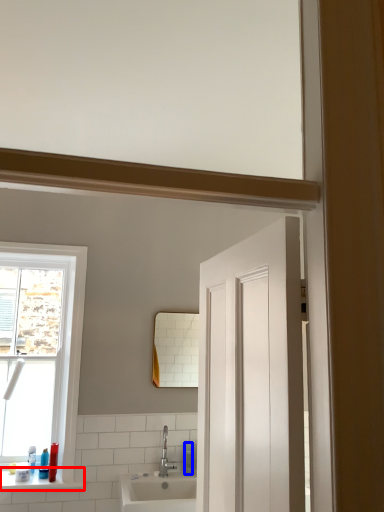
Question: Among these objects, which one is nearest to the camera, window sill (highlighted by a red box) or soap dispenser (highlighted by a blue box)?

Choices:
 (A) window sill
 (B) soap dispenser

Answer: (A)